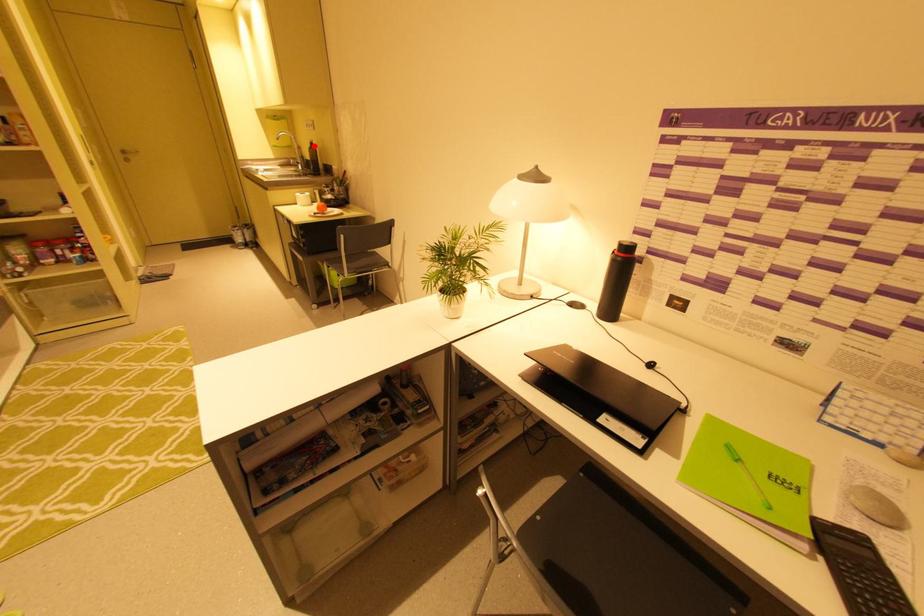
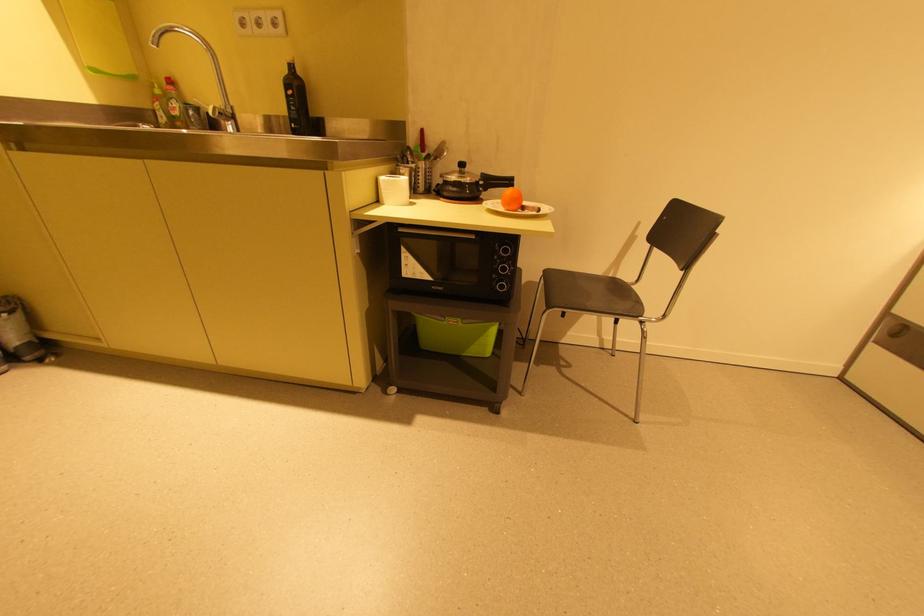
Question: I am providing you with two images of the same scene from different viewpoints. Image1 has a red point marked. In image2, the corresponding 3D location appears at what relative position? Reply with the corresponding letter.

Choices:
 (A) Closer
 (B) Farther

Answer: (B)